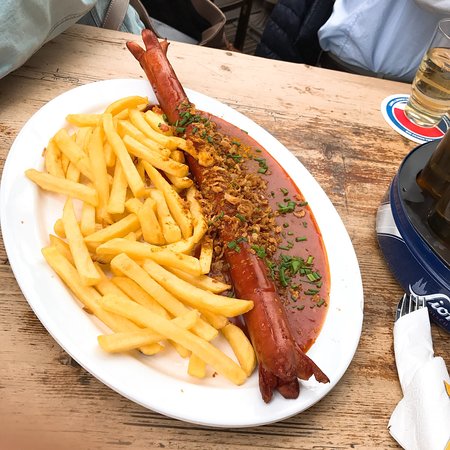
This screenshot has height=450, width=450. Identify the location of table top. [348, 153].